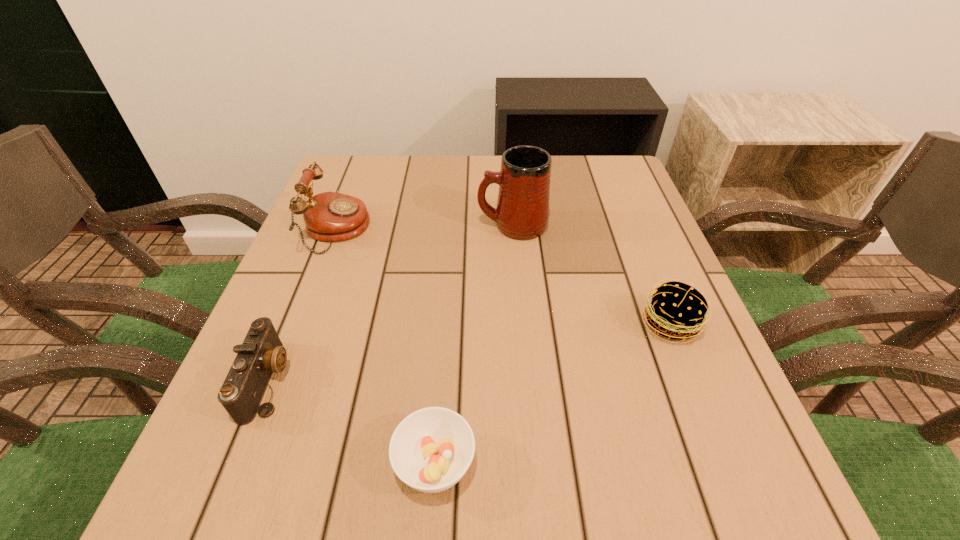
The image size is (960, 540). Find the location of `free region that satisfies the following two spatial constraints: 1. on the dial of the shortest object; 2. on the left side of the second tallest object`. free region that satisfies the following two spatial constraints: 1. on the dial of the shortest object; 2. on the left side of the second tallest object is located at coordinates (248, 464).

The image size is (960, 540). What are the coordinates of `free spot that satisfies the following two spatial constraints: 1. on the dial of the telephone; 2. on the right side of the patty` in the screenshot? It's located at (300, 325).

Where is `vacant space that satisfies the following two spatial constraints: 1. on the dial of the shortest object; 2. on the left side of the fourth shortest object`? This screenshot has height=540, width=960. vacant space that satisfies the following two spatial constraints: 1. on the dial of the shortest object; 2. on the left side of the fourth shortest object is located at coordinates (248, 464).

Find the location of a particular element. The image size is (960, 540). vacant point that satisfies the following two spatial constraints: 1. on the front-facing side of the soup bowl; 2. on the right side of the camera is located at coordinates (234, 464).

Identify the location of vacant area that satisfies the following two spatial constraints: 1. on the front-facing side of the shortest object; 2. on the left side of the camera. The image size is (960, 540). (234, 464).

What are the coordinates of `vacant space that satisfies the following two spatial constraints: 1. on the dial of the patty; 2. on the left side of the fourth shortest object` in the screenshot? It's located at (300, 325).